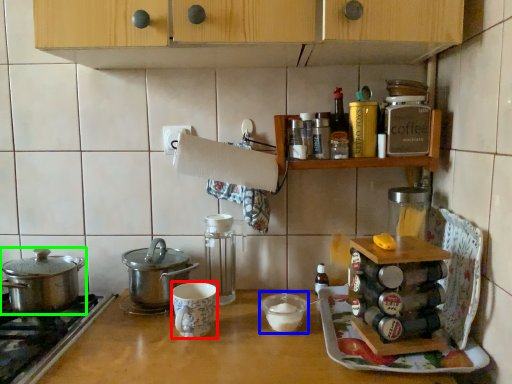
Question: Which is nearer to the mug (highlighted by a red box)? appliance (highlighted by a blue box) or kitchen appliance (highlighted by a green box).

Choices:
 (A) appliance
 (B) kitchen appliance

Answer: (A)